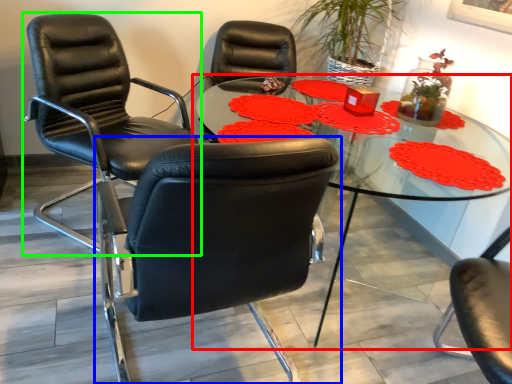
Question: Considering the real-world distances, which object is closest to table (highlighted by a red box)? chair (highlighted by a blue box) or chair (highlighted by a green box).

Choices:
 (A) chair
 (B) chair

Answer: (A)